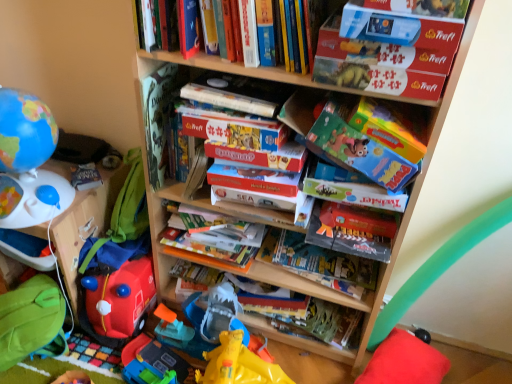
Question: Is hardcover book at center, arranged as the first book when ordered from the bottom, oriented away from matte cardboard book at center, which ranks as the second paperback book in left-to-right order?

Choices:
 (A) no
 (B) yes

Answer: (A)

Question: Would you consider hardcover book at center, arranged as the first book when ordered from the bottom, to be distant from matte cardboard book at center, which is counted as the first paperback book, starting from the bottom?

Choices:
 (A) yes
 (B) no

Answer: (B)

Question: Are hardcover book at center, placed as the 4th book when sorted from top to bottom, and matte cardboard book at center, which ranks as the 2th paperback book in top-to-bottom order, making contact?

Choices:
 (A) no
 (B) yes

Answer: (A)

Question: From the image's perspective, would you say hardcover book at center, placed as the 4th book when sorted from top to bottom, is shown under matte cardboard book at center, which ranks as the 2th paperback book in top-to-bottom order?

Choices:
 (A) no
 (B) yes

Answer: (B)

Question: Is hardcover book at center, arranged as the first book when ordered from the bottom, thinner than matte cardboard book at center, which is counted as the first paperback book, starting from the bottom?

Choices:
 (A) no
 (B) yes

Answer: (B)

Question: Considering the positions of white plastic toy at left and hardcover book at center, which appears as the 2th book when ordered from the bottom, in the image, is white plastic toy at left bigger or smaller than hardcover book at center, which appears as the 2th book when ordered from the bottom,?

Choices:
 (A) big
 (B) small

Answer: (A)

Question: Considering the positions of point (67, 208) and point (276, 228), is point (67, 208) closer or farther from the camera than point (276, 228)?

Choices:
 (A) farther
 (B) closer

Answer: (B)

Question: Is white plastic toy at left spatially inside hardcover book at center, the 3th book positioned from the top, or outside of it?

Choices:
 (A) outside
 (B) inside

Answer: (A)

Question: In terms of width, does white plastic toy at left look wider or thinner when compared to hardcover book at center, which appears as the 2th book when ordered from the bottom?

Choices:
 (A) wide
 (B) thin

Answer: (A)

Question: Considering the positions of hardcover book at center, which appears as the 2th book when ordered from the bottom, and green fabric bean bag at lower left in the image, is hardcover book at center, which appears as the 2th book when ordered from the bottom, wider or thinner than green fabric bean bag at lower left?

Choices:
 (A) thin
 (B) wide

Answer: (A)

Question: Is hardcover book at center, the 3th book positioned from the top, situated inside green fabric bean bag at lower left or outside?

Choices:
 (A) outside
 (B) inside

Answer: (A)

Question: Looking at the image, does hardcover book at center, the 3th book positioned from the top, seem bigger or smaller compared to green fabric bean bag at lower left?

Choices:
 (A) big
 (B) small

Answer: (B)

Question: From a real-world perspective, is hardcover book at center, the 3th book positioned from the top, positioned above or below green fabric bean bag at lower left?

Choices:
 (A) below
 (B) above

Answer: (B)

Question: Is green fabric bean bag at lower left bigger or smaller than rubberized red fire truck at lower left, the second toy viewed from the top?

Choices:
 (A) small
 (B) big

Answer: (B)

Question: In terms of height, does green fabric bean bag at lower left look taller or shorter compared to rubberized red fire truck at lower left, the 2th toy viewed from the left?

Choices:
 (A) tall
 (B) short

Answer: (B)